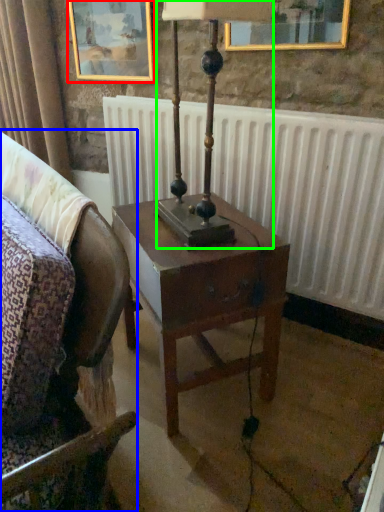
Question: Based on their relative distances, which object is nearer to picture frame (highlighted by a red box)? Choose from chair (highlighted by a blue box) and bedside lamp (highlighted by a green box).

Choices:
 (A) chair
 (B) bedside lamp

Answer: (B)